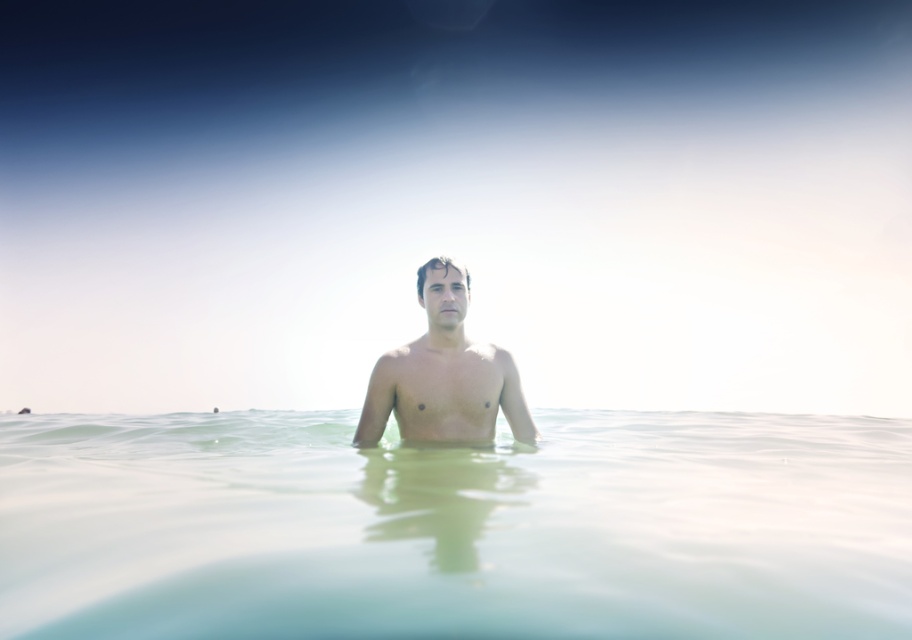
Question: Does clear water at center appear over smooth skin man at center?

Choices:
 (A) yes
 (B) no

Answer: (B)

Question: Is clear water at center bigger than smooth skin man at center?

Choices:
 (A) no
 (B) yes

Answer: (B)

Question: Among these objects, which one is nearest to the camera?

Choices:
 (A) clear water at center
 (B) smooth skin man at center

Answer: (A)

Question: Which point appears farthest from the camera in this image?

Choices:
 (A) (198, 504)
 (B) (392, 376)

Answer: (B)

Question: Is clear water at center smaller than smooth skin man at center?

Choices:
 (A) yes
 (B) no

Answer: (B)